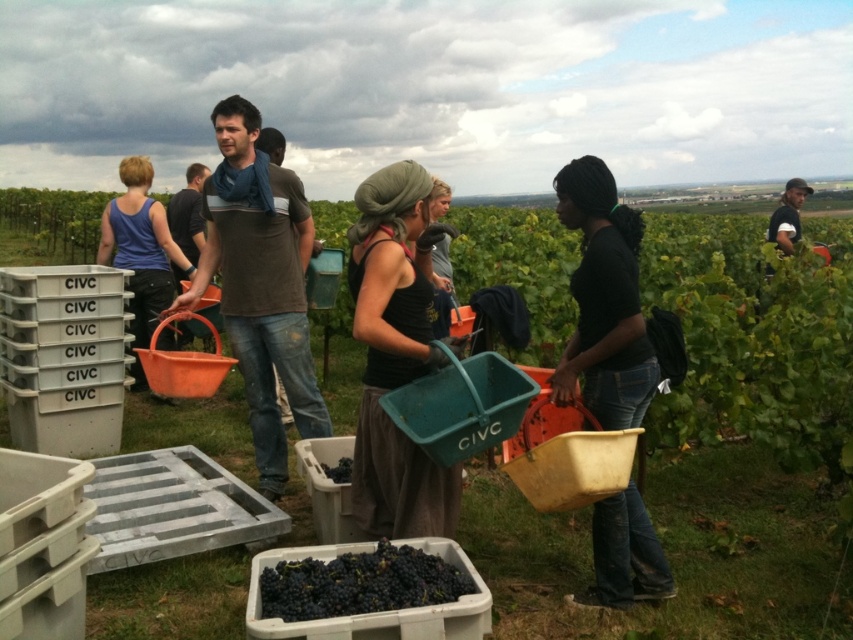
Between point (218, 243) and point (412, 580), which one is positioned behind?

The point (218, 243) is more distant.

Between brown cotton shirt at center and dark matte grapes at center, which one has less height?

Standing shorter between the two is dark matte grapes at center.

Does point (312, 419) lie behind point (387, 566)?

That is True.

Where is `brown cotton shirt at center`? The width and height of the screenshot is (853, 640). brown cotton shirt at center is located at coordinates (260, 284).

Can you confirm if black matte shirt at center is smaller than matte blue tank top at left?

Correct, black matte shirt at center occupies less space than matte blue tank top at left.

At what (x,y) coordinates should I click in order to perform the action: click on black matte shirt at center. Please return your answer as a coordinate pair (x, y). Looking at the image, I should click on pyautogui.click(x=604, y=301).

Does point (634, 310) come behind point (146, 205)?

No, it is in front of (146, 205).

Locate an element on the screen. This screenshot has width=853, height=640. black matte shirt at center is located at coordinates (604, 301).

Between point (137, 371) and point (341, 461), which one is positioned in front?

Point (341, 461) is in front.

Which is behind, point (103, 243) or point (349, 474)?

The point (103, 243) is more distant.

Who is more distant from viewer, (154, 284) or (323, 470)?

The point (154, 284) is behind.

Identify the location of matte blue tank top at left. (141, 246).